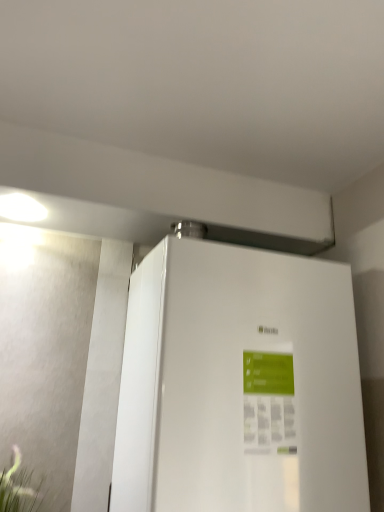
Image resolution: width=384 pixels, height=512 pixels. Describe the element at coordinates (239, 384) in the screenshot. I see `white glossy refrigerator at center` at that location.

You are a GUI agent. You are given a task and a screenshot of the screen. Output one action in this format:
    pyautogui.click(x=<x>, y=<y>)
    Task: Click on the white glossy refrigerator at center
    This screenshot has width=384, height=512.
    Given the screenshot: What is the action you would take?
    pyautogui.click(x=239, y=384)

Where is `white glossy refrigerator at center`? white glossy refrigerator at center is located at coordinates (239, 384).